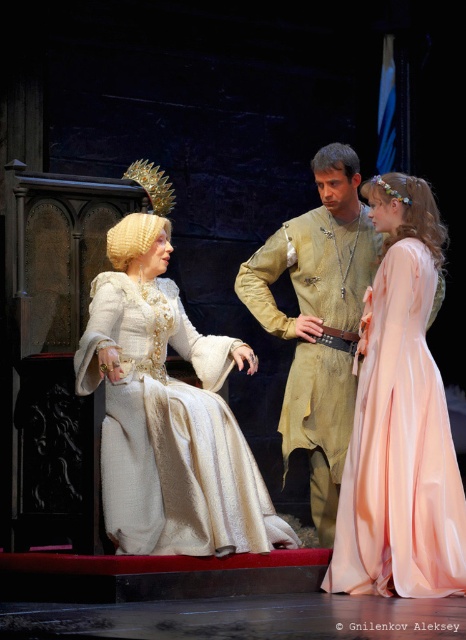
Between point (268, 547) and point (282, 225), which one is positioned behind?

The point (282, 225) is more distant.

Is point (163, 380) more distant than point (286, 428)?

No, (163, 380) is in front of (286, 428).

Image resolution: width=466 pixels, height=640 pixels. What do you see at coordinates (171, 432) in the screenshot?
I see `white satin dress at center` at bounding box center [171, 432].

Locate an element on the screen. Image resolution: width=466 pixels, height=640 pixels. white satin dress at center is located at coordinates (171, 432).

Which is behind, point (418, 486) or point (271, 330)?

The point (271, 330) is more distant.

Is point (376, 442) more distant than point (331, 531)?

No, it is not.

Between point (430, 416) and point (305, 273), which one is positioned in front?

Point (430, 416) is in front.

What are the coordinates of `pale pink satin dress at right` in the screenshot? It's located at (399, 451).

Who is shorter, white satin dress at center or pale pink satin dress at right?

Standing shorter between the two is white satin dress at center.

Does white satin dress at center appear on the right side of pale pink satin dress at right?

Incorrect, white satin dress at center is not on the right side of pale pink satin dress at right.

Identify the location of white satin dress at center. Image resolution: width=466 pixels, height=640 pixels. coord(171,432).